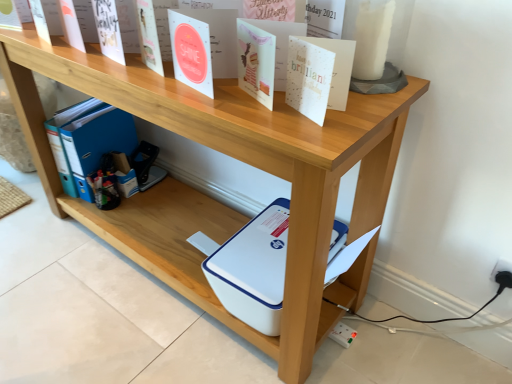
Question: Are white plastic electric outlet at lower right and white paper at upper center, the second paperback book viewed from the left, making contact?

Choices:
 (A) no
 (B) yes

Answer: (A)

Question: From the image's perspective, is white plastic electric outlet at lower right under white paper at upper center, which is the 2th paperback book from back to front?

Choices:
 (A) yes
 (B) no

Answer: (A)

Question: Is white plastic electric outlet at lower right positioned far away from white paper at upper center, which is the 2th paperback book from back to front?

Choices:
 (A) no
 (B) yes

Answer: (A)

Question: From the image's perspective, is white plastic electric outlet at lower right on white paper at upper center, which is the 2th paperback book from back to front?

Choices:
 (A) no
 (B) yes

Answer: (A)

Question: Considering the relative sizes of white plastic electric outlet at lower right and white paper at upper center, the 1th paperback book positioned from the right, in the image provided, is white plastic electric outlet at lower right bigger than white paper at upper center, the 1th paperback book positioned from the right,?

Choices:
 (A) no
 (B) yes

Answer: (A)

Question: Based on their positions, is white matte paper at upper center, marked as the first paperback book in a top-to-bottom arrangement, located to the left or right of white plastic electric outlet at lower right?

Choices:
 (A) right
 (B) left

Answer: (B)

Question: Considering the positions of point (104, 11) and point (501, 274), is point (104, 11) closer or farther from the camera than point (501, 274)?

Choices:
 (A) farther
 (B) closer

Answer: (B)

Question: Is white matte paper at upper center, marked as the first paperback book in a top-to-bottom arrangement, wider or thinner than white plastic electric outlet at lower right?

Choices:
 (A) wide
 (B) thin

Answer: (A)

Question: Considering their positions, is white matte paper at upper center, the 2th paperback book from the front, located in front of or behind white plastic electric outlet at lower right?

Choices:
 (A) behind
 (B) front

Answer: (B)

Question: From the image's perspective, relative to white plastic electric outlet at lower right, is white paper at upper center, which is the 2th paperback book from back to front, above or below?

Choices:
 (A) below
 (B) above

Answer: (B)

Question: Considering the relative positions of white paper at upper center, which is the 2th paperback book from back to front, and white plastic electric outlet at lower right in the image provided, is white paper at upper center, which is the 2th paperback book from back to front, to the left or to the right of white plastic electric outlet at lower right?

Choices:
 (A) left
 (B) right

Answer: (A)

Question: Is point (294, 67) closer or farther from the camera than point (506, 261)?

Choices:
 (A) farther
 (B) closer

Answer: (B)

Question: Is white paper at upper center, the 1th paperback book positioned from the right, situated inside white plastic electric outlet at lower right or outside?

Choices:
 (A) inside
 (B) outside

Answer: (B)

Question: Is point (297, 74) positioned closer to the camera than point (110, 6)?

Choices:
 (A) closer
 (B) farther

Answer: (A)

Question: Based on their positions, is white paper at upper center, the 2th paperback book viewed from the top, located to the left or right of white matte paper at upper center, marked as the first paperback book in a top-to-bottom arrangement?

Choices:
 (A) right
 (B) left

Answer: (A)